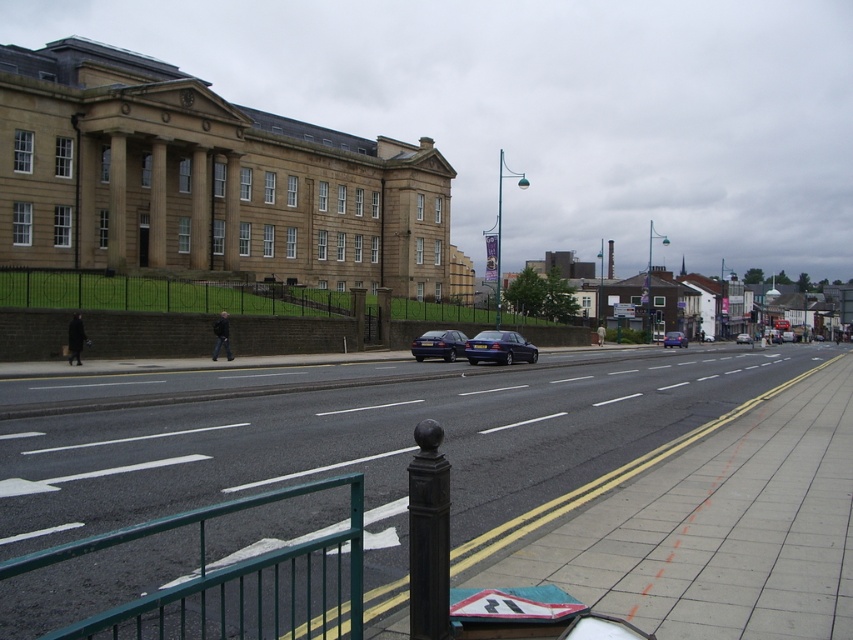
You are a delivery driver who needs to park your vehicle between the two cars at the center of the road. Your vehicle is 1.8 meters wide. Can you fit your vehicle between the matte blue car at center and the blue metallic sedan at center?

The matte blue car at center is thinner than the blue metallic sedan at center, but without knowing the exact width between them, it is impossible to determine if your vehicle can fit.

You are standing on the sidewalk near the green metal railing and want to cross the street to the bus stop located 100 meters away. The matte blue car at center is blocking your path. Can you safely walk around it to reach the bus stop?

The matte blue car at center is 73.82 meters from the viewer. Since it is blocking your path, you can walk around it as it is only 73.82 meters away, which is within a safe distance to navigate around before reaching the bus stop 100 meters ahead.